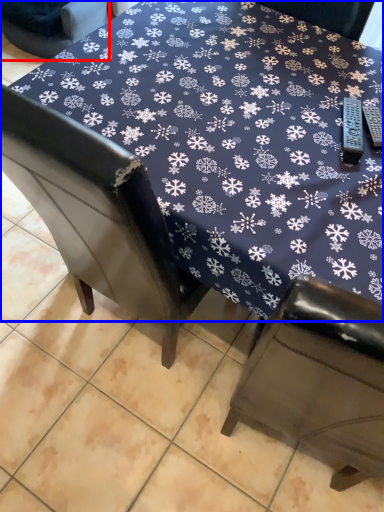
Question: Which point is further to the camera, chair (highlighted by a red box) or table (highlighted by a blue box)?

Choices:
 (A) chair
 (B) table

Answer: (A)